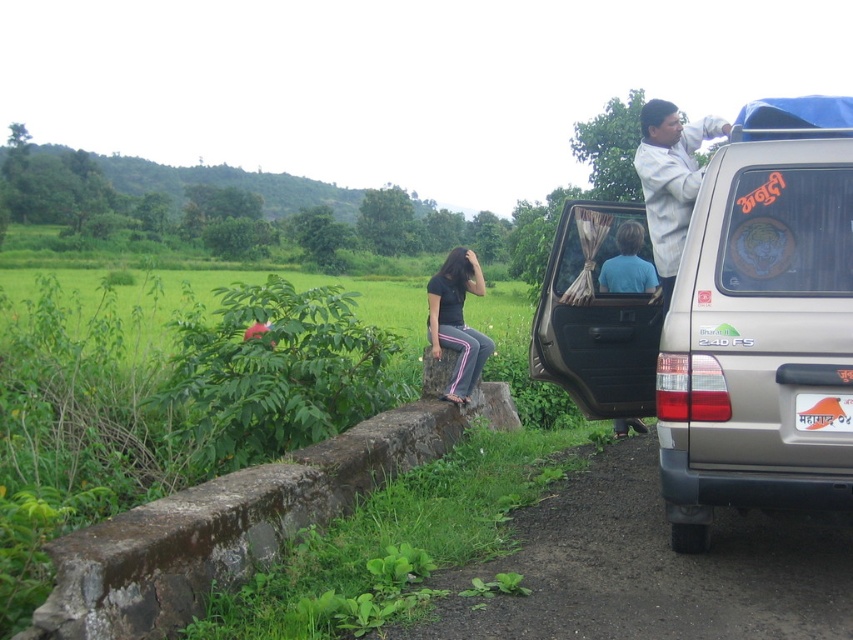
Question: Which of these objects is positioned farthest from the white cotton shirt at upper right?

Choices:
 (A) matte black shirt at center
 (B) silver metallic jeep at right

Answer: (A)

Question: Can you confirm if silver metallic jeep at right is wider than matte black shirt at center?

Choices:
 (A) yes
 (B) no

Answer: (B)

Question: Can you confirm if silver metallic jeep at right is positioned to the left of matte black shirt at center?

Choices:
 (A) yes
 (B) no

Answer: (B)

Question: Which object is positioned closest to the matte black shirt at center?

Choices:
 (A) silver metallic jeep at right
 (B) white cotton shirt at upper right

Answer: (B)

Question: Which object is farther from the camera taking this photo?

Choices:
 (A) silver metallic jeep at right
 (B) white cotton shirt at upper right
 (C) matte black shirt at center

Answer: (C)

Question: Does white cotton shirt at upper right lie behind matte black shirt at center?

Choices:
 (A) no
 (B) yes

Answer: (A)